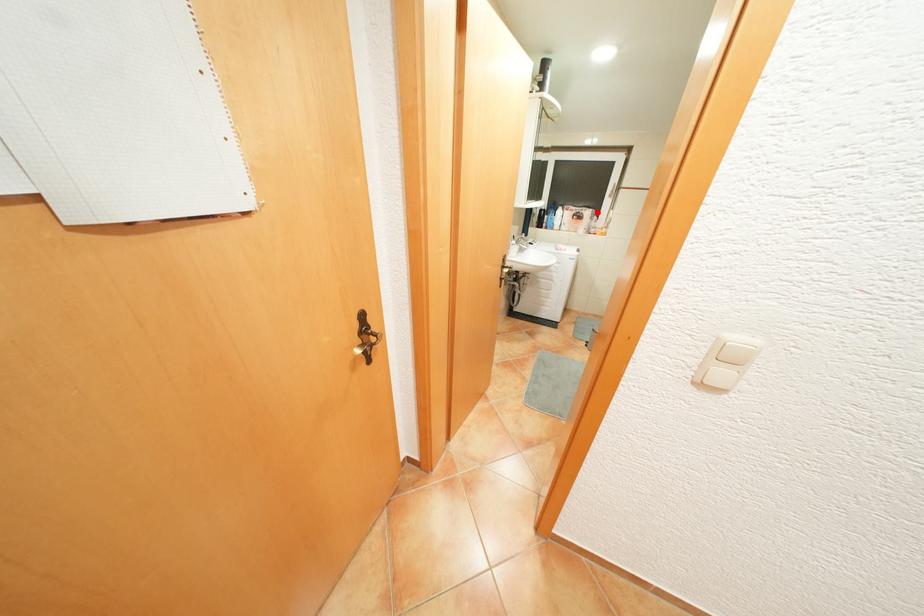
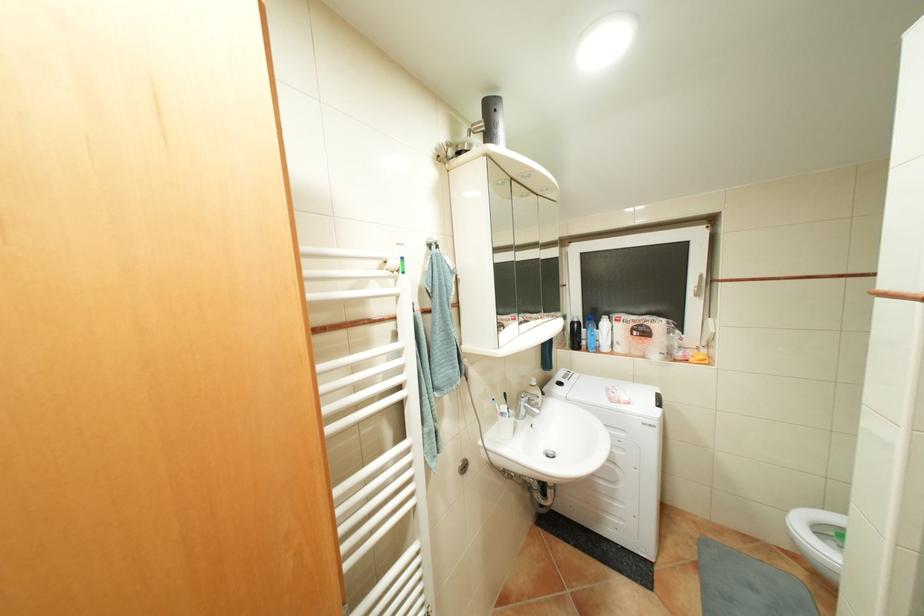
Find the pixel in the second image that matches the highlighted location in the first image.

(667, 323)